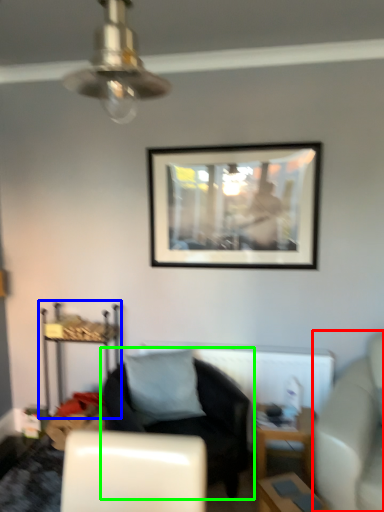
Question: Considering the real-world distances, which object is farthest from studio couch (highlighted by a red box)? dresser (highlighted by a blue box) or chair (highlighted by a green box)?

Choices:
 (A) dresser
 (B) chair

Answer: (A)